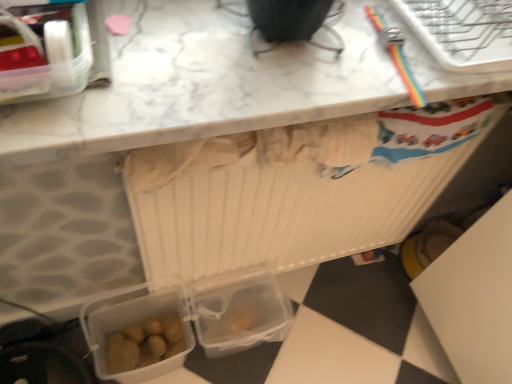
Where is `vacant location behind rainbow plastic bracelet at upper right`? vacant location behind rainbow plastic bracelet at upper right is located at coordinates (421, 15).